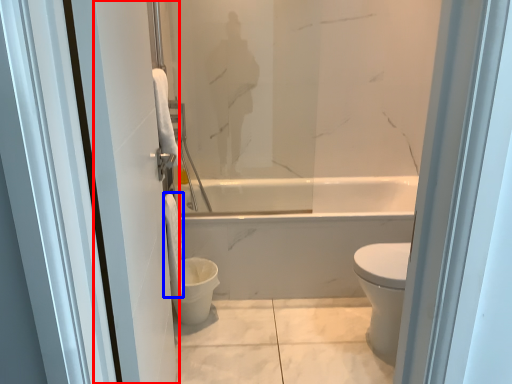
Question: Which object is further to the camera taking this photo, screen door (highlighted by a red box) or toilet paper (highlighted by a blue box)?

Choices:
 (A) screen door
 (B) toilet paper

Answer: (B)